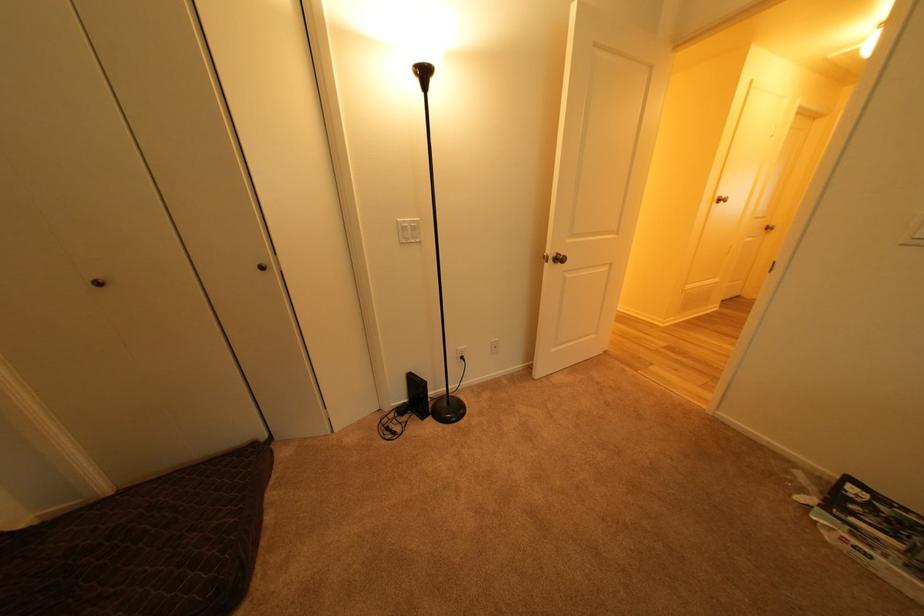
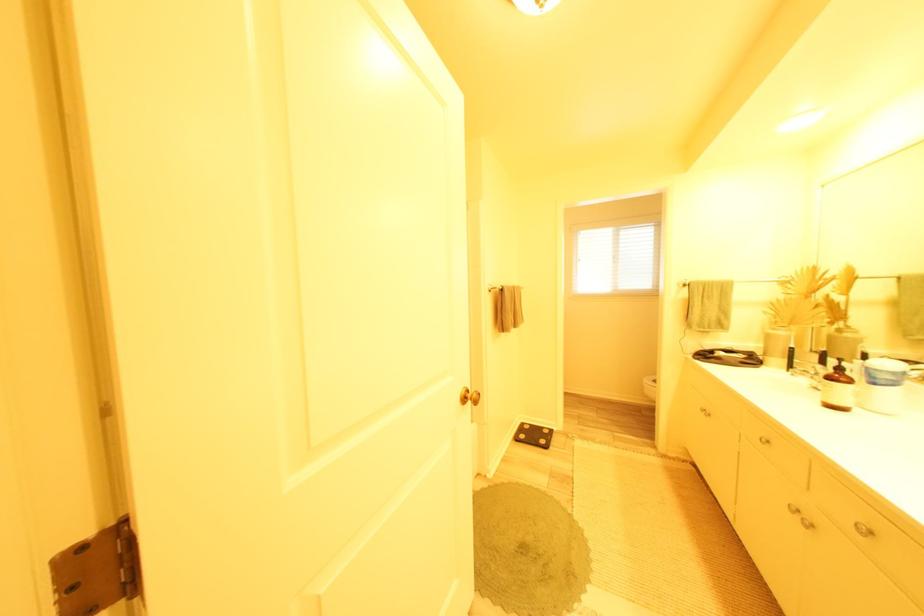
Question: I am providing you with two images of the same scene from different viewpoints. Please identify which objects are invisible in image2.

Choices:
 (A) gold door knob
 (B) brass door knob
 (C) green bottle pump
 (D) toilet paper package

Answer: (B)